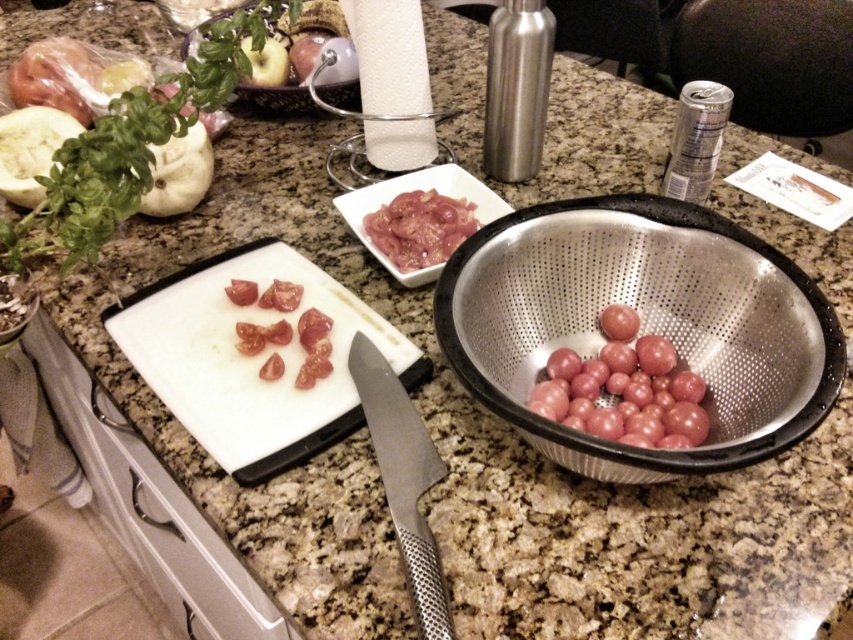
You are arranging food items on a kitchen counter. You have a pink glossy meat at center and a matte white apple at upper left. According to the scene, which item is positioned to the right of the other?

The pink glossy meat at center is to the right of the matte white apple at upper left.

You are a chef preparing a dish and need to know the spatial relationship between the pink glossy meat at center and the green leafy basil at upper left. Which one is positioned above the other?

The pink glossy meat at center is below green leafy basil at upper left, so the green leafy basil at upper left is above the pink glossy meat at center.

You are a chef preparing a dish and need to place the pink glossy meat at center and the matte white apple at upper left into a rectangular plate that is 12 inches long. Can both items fit side by side on the plate without overlapping?

The distance between the pink glossy meat at center and the matte white apple at upper left is 10.25 inches. Since the plate is 12 inches long, which is longer than the combined width of the two items, they can fit side by side without overlapping.